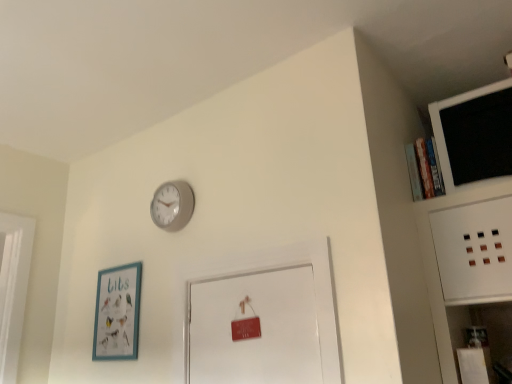
I want to click on teal matte picture frame at lower left, so click(x=117, y=313).

Find the location of a particular element. This screenshot has width=512, height=384. wall clock in front of the teal matte picture frame at lower left is located at coordinates (172, 205).

Considering the sizes of objects matte gray clock at upper center and teal matte picture frame at lower left in the image provided, who is bigger, matte gray clock at upper center or teal matte picture frame at lower left?

With larger size is teal matte picture frame at lower left.

Does matte gray clock at upper center come in front of teal matte picture frame at lower left?

Yes, matte gray clock at upper center is closer to the viewer.

In the scene shown: From a real-world perspective, which is physically below, matte gray clock at upper center or teal matte picture frame at lower left?

teal matte picture frame at lower left.

Which is more distant, (112, 331) or (159, 216)?

Point (112, 331)

Considering the relative sizes of teal matte picture frame at lower left and matte gray clock at upper center in the image provided, is teal matte picture frame at lower left smaller than matte gray clock at upper center?

Actually, teal matte picture frame at lower left might be larger than matte gray clock at upper center.

Considering the relative sizes of teal matte picture frame at lower left and matte gray clock at upper center in the image provided, is teal matte picture frame at lower left shorter than matte gray clock at upper center?

In fact, teal matte picture frame at lower left may be taller than matte gray clock at upper center.

Is matte gray clock at upper center not near black matte computer monitor at upper right?

Yes.

Identify the location of wall clock located behind the black matte computer monitor at upper right. The width and height of the screenshot is (512, 384). (172, 205).

Is matte gray clock at upper center aimed at black matte computer monitor at upper right?

No, matte gray clock at upper center is not facing towards black matte computer monitor at upper right.

Is matte gray clock at upper center not inside black matte computer monitor at upper right?

That's correct, matte gray clock at upper center is outside of black matte computer monitor at upper right.

From the image's perspective, is black matte computer monitor at upper right above or below matte gray clock at upper center?

Clearly, from the image's perspective, black matte computer monitor at upper right is above matte gray clock at upper center.

Is matte gray clock at upper center at the back of black matte computer monitor at upper right?

No, black matte computer monitor at upper right is not facing away from matte gray clock at upper center.

Can you confirm if black matte computer monitor at upper right is thinner than matte gray clock at upper center?

No.

Considering the relative positions of black matte computer monitor at upper right and matte gray clock at upper center in the image provided, is black matte computer monitor at upper right to the left of matte gray clock at upper center from the viewer's perspective?

No.

From the picture: Who is taller, teal matte picture frame at lower left or black matte computer monitor at upper right?

Standing taller between the two is teal matte picture frame at lower left.

Considering the sizes of objects teal matte picture frame at lower left and black matte computer monitor at upper right in the image provided, who is smaller, teal matte picture frame at lower left or black matte computer monitor at upper right?

teal matte picture frame at lower left is smaller.

Is teal matte picture frame at lower left next to black matte computer monitor at upper right?

No, teal matte picture frame at lower left is not making contact with black matte computer monitor at upper right.

Considering the positions of objects teal matte picture frame at lower left and black matte computer monitor at upper right in the image provided, who is more to the right, teal matte picture frame at lower left or black matte computer monitor at upper right?

Positioned to the right is black matte computer monitor at upper right.

Can you confirm if black matte computer monitor at upper right is shorter than teal matte picture frame at lower left?

Yes.

Considering the points (452, 146) and (118, 278), which point is in front, point (452, 146) or point (118, 278)?

Point (452, 146)

From the picture: Is black matte computer monitor at upper right bigger than teal matte picture frame at lower left?

Yes.

This screenshot has height=384, width=512. Identify the location of wall clock positioned vertically above the teal matte picture frame at lower left (from a real-world perspective). (172, 205).

I want to click on wall clock lying above the teal matte picture frame at lower left (from the image's perspective), so click(x=172, y=205).

When comparing their distances from teal matte picture frame at lower left, does black matte computer monitor at upper right or matte gray clock at upper center seem further?

black matte computer monitor at upper right lies further to teal matte picture frame at lower left than the other object.

Estimate the real-world distances between objects in this image. Which object is closer to black matte computer monitor at upper right, teal matte picture frame at lower left or matte gray clock at upper center?

Based on the image, matte gray clock at upper center appears to be nearer to black matte computer monitor at upper right.

When comparing their distances from matte gray clock at upper center, does black matte computer monitor at upper right or teal matte picture frame at lower left seem closer?

The object closer to matte gray clock at upper center is teal matte picture frame at lower left.

Looking at the image, which one is located further to teal matte picture frame at lower left, matte gray clock at upper center or black matte computer monitor at upper right?

black matte computer monitor at upper right lies further to teal matte picture frame at lower left than the other object.

From the picture: When comparing their distances from matte gray clock at upper center, does teal matte picture frame at lower left or black matte computer monitor at upper right seem further?

black matte computer monitor at upper right.

Estimate the real-world distances between objects in this image. Which object is closer to black matte computer monitor at upper right, matte gray clock at upper center or teal matte picture frame at lower left?

matte gray clock at upper center.

You are a GUI agent. You are given a task and a screenshot of the screen. Output one action in this format:
    pyautogui.click(x=<x>, y=<y>)
    Task: Click on the wall clock located between teal matte picture frame at lower left and black matte computer monitor at upper right in the left-right direction
    Image resolution: width=512 pixels, height=384 pixels.
    Given the screenshot: What is the action you would take?
    pyautogui.click(x=172, y=205)